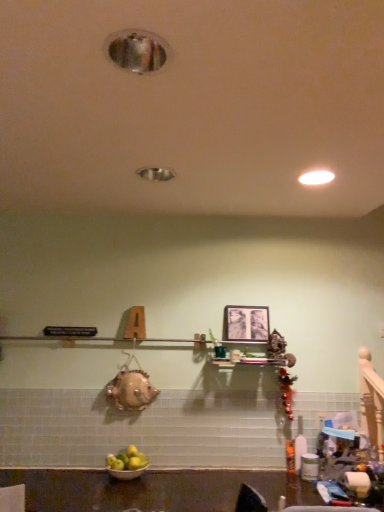
Question: Is matte black picture frame at center closer to the viewer compared to white glossy light fixture at upper right?

Choices:
 (A) no
 (B) yes

Answer: (A)

Question: Is matte black picture frame at center positioned behind white glossy light fixture at upper right?

Choices:
 (A) no
 (B) yes

Answer: (B)

Question: Is matte black picture frame at center to the right of white glossy light fixture at upper right from the viewer's perspective?

Choices:
 (A) yes
 (B) no

Answer: (B)

Question: Is matte black picture frame at center directly adjacent to white glossy light fixture at upper right?

Choices:
 (A) yes
 (B) no

Answer: (B)

Question: From a real-world perspective, is matte black picture frame at center located higher than white glossy light fixture at upper right?

Choices:
 (A) yes
 (B) no

Answer: (B)

Question: Can you confirm if matte black picture frame at center is shorter than white glossy light fixture at upper right?

Choices:
 (A) no
 (B) yes

Answer: (A)

Question: From the image's perspective, does white glossy light fixture at upper right appear higher than matte black picture frame at center?

Choices:
 (A) no
 (B) yes

Answer: (B)

Question: Is white glossy light fixture at upper right directly adjacent to matte black picture frame at center?

Choices:
 (A) no
 (B) yes

Answer: (A)

Question: Is white glossy light fixture at upper right completely or partially outside of matte black picture frame at center?

Choices:
 (A) no
 (B) yes

Answer: (B)

Question: Is white glossy light fixture at upper right positioned in front of matte black picture frame at center?

Choices:
 (A) no
 (B) yes

Answer: (B)

Question: Considering the relative sizes of white glossy light fixture at upper right and matte black picture frame at center in the image provided, is white glossy light fixture at upper right taller than matte black picture frame at center?

Choices:
 (A) yes
 (B) no

Answer: (B)

Question: Can you confirm if white glossy light fixture at upper right is smaller than matte black picture frame at center?

Choices:
 (A) no
 (B) yes

Answer: (B)

Question: Can you confirm if white glossy bowl at lower center is thinner than white glossy light fixture at upper right?

Choices:
 (A) no
 (B) yes

Answer: (A)